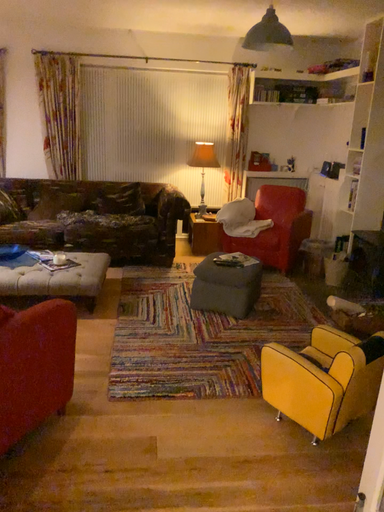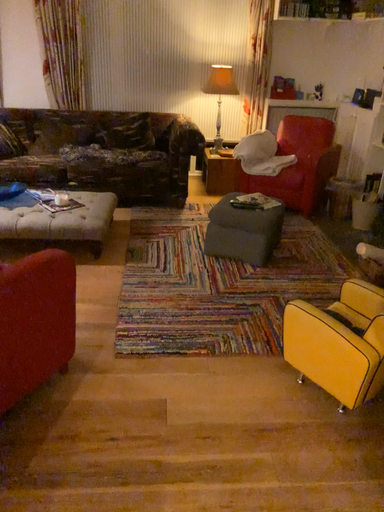
Question: Which way did the camera rotate in the video?

Choices:
 (A) rotated downward
 (B) rotated upward

Answer: (A)